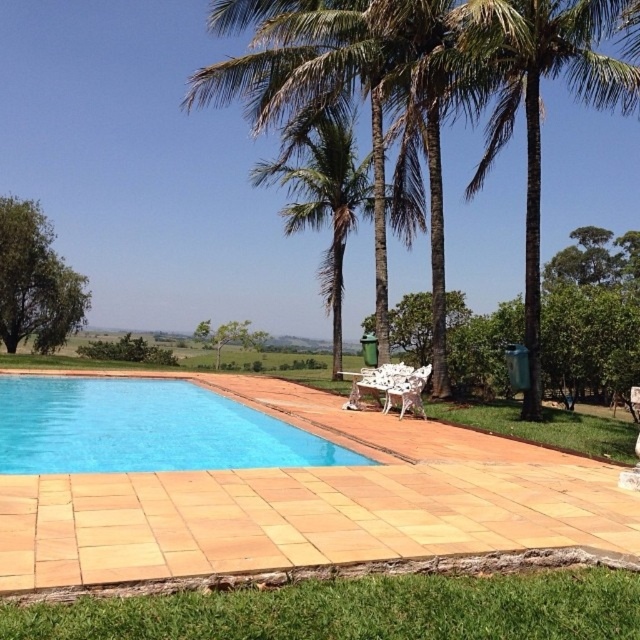
Is blue smooth pool at lower left further to the viewer compared to green leafy palm tree at upper right?

No, blue smooth pool at lower left is in front of green leafy palm tree at upper right.

Describe the element at coordinates (145, 428) in the screenshot. This screenshot has height=640, width=640. I see `blue smooth pool at lower left` at that location.

The width and height of the screenshot is (640, 640). Find the location of `blue smooth pool at lower left`. blue smooth pool at lower left is located at coordinates (145, 428).

Is blue smooth pool at lower left to the left of green leafy tree at left from the viewer's perspective?

No, blue smooth pool at lower left is not to the left of green leafy tree at left.

Can you confirm if blue smooth pool at lower left is positioned to the right of green leafy tree at left?

Indeed, blue smooth pool at lower left is positioned on the right side of green leafy tree at left.

Between point (113, 440) and point (24, 225), which one is positioned behind?

Positioned behind is point (24, 225).

At what (x,y) coordinates should I click in order to perform the action: click on blue smooth pool at lower left. Please return your answer as a coordinate pair (x, y). Looking at the image, I should click on (145, 428).

Between point (474, 28) and point (362, 170), which one is positioned behind?

Positioned behind is point (362, 170).

Which is behind, point (634, 84) or point (282, 163)?

The point (282, 163) is behind.

You are a GUI agent. You are given a task and a screenshot of the screen. Output one action in this format:
    pyautogui.click(x=<x>, y=<y>)
    Task: Click on the green leafy palm tree at upper right
    The height and width of the screenshot is (640, 640).
    Given the screenshot: What is the action you would take?
    pyautogui.click(x=536, y=102)